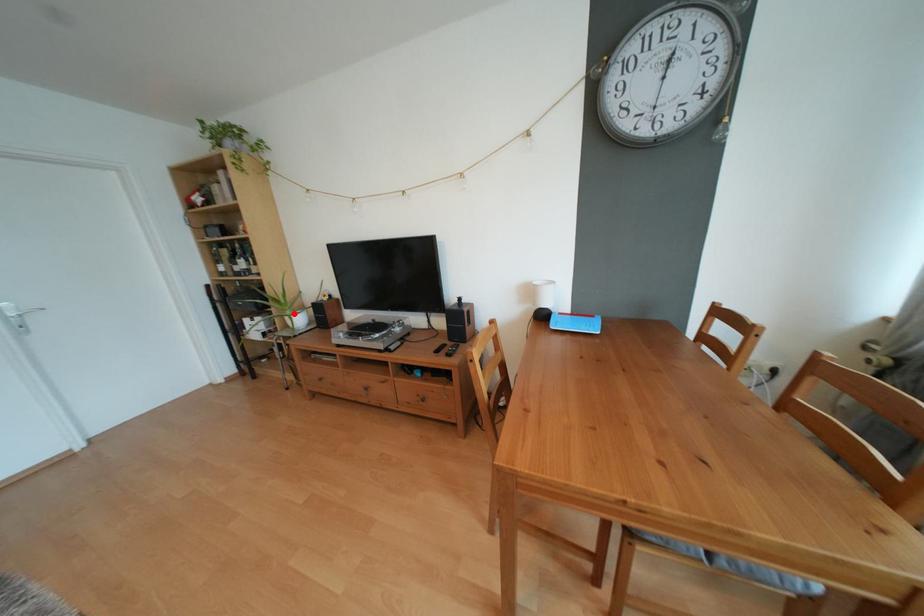
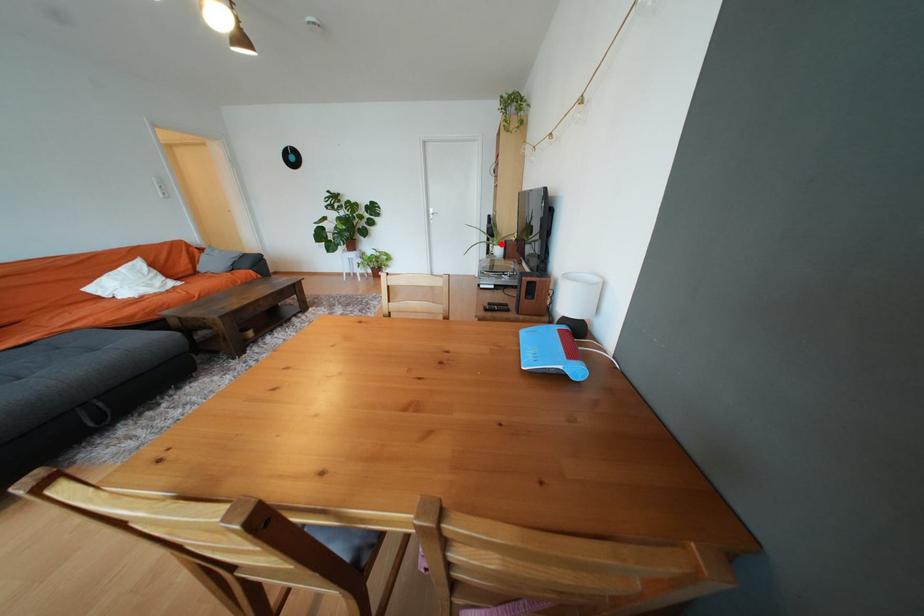
I am providing you with two images of the same scene from different viewpoints. A red point is marked on the first image and another point is marked on the second image. Is the red point in image1 aligned with the point shown in image2?

Yes